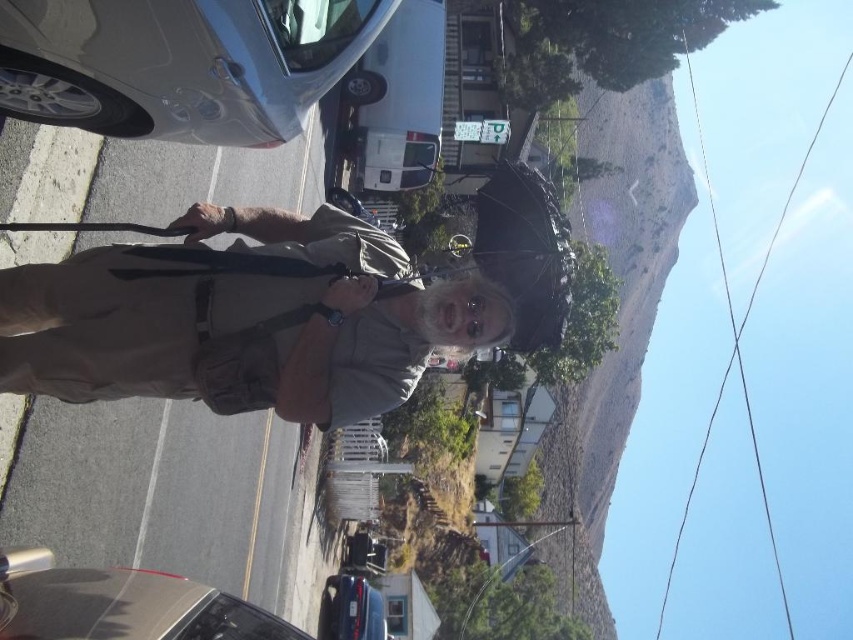
Question: Where is satin silver sedan at upper left located in relation to black matte umbrella at center in the image?

Choices:
 (A) above
 (B) below

Answer: (B)

Question: Which point appears closest to the camera in this image?

Choices:
 (A) (100, 612)
 (B) (534, 312)
 (C) (329, 595)
 (D) (96, 80)

Answer: (A)

Question: Is shiny black car at lower left to the left of black matte umbrella at center from the viewer's perspective?

Choices:
 (A) yes
 (B) no

Answer: (A)

Question: Which object appears farthest from the camera in this image?

Choices:
 (A) black matte umbrella at center
 (B) satin silver sedan at upper left
 (C) khaki fabric shirt at center

Answer: (A)

Question: Which object appears farthest from the camera in this image?

Choices:
 (A) khaki fabric shirt at center
 (B) satin silver sedan at upper left

Answer: (A)

Question: Can you confirm if satin silver sedan at upper left is positioned above shiny black car at lower left?

Choices:
 (A) no
 (B) yes

Answer: (B)